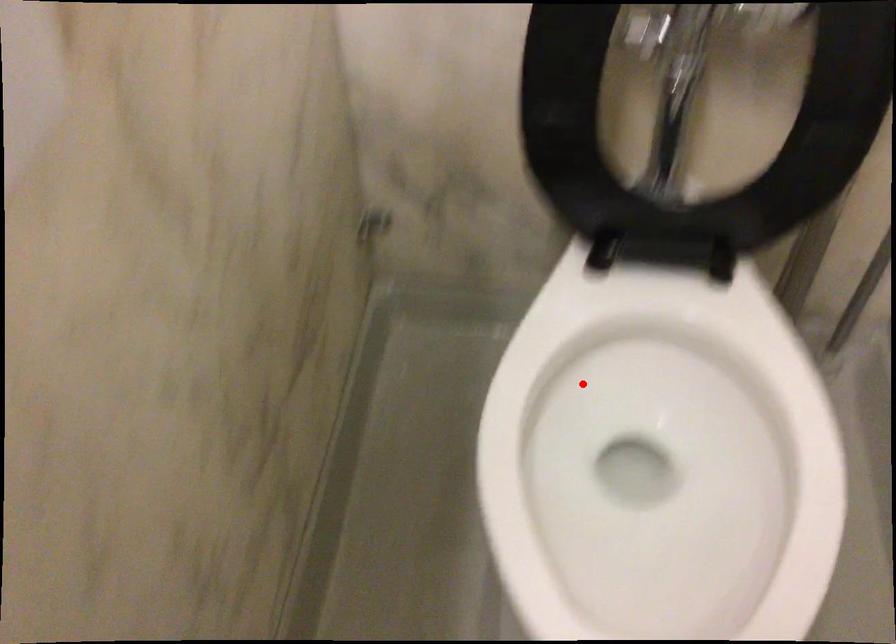
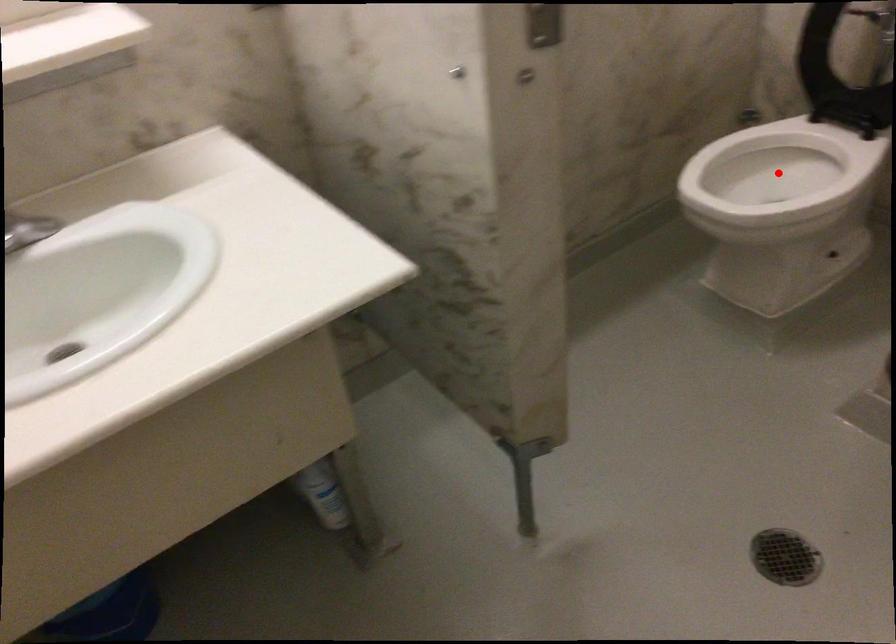
I am providing you with two images of the same scene from different viewpoints. A red point is marked on the first image and another point is marked on the second image. Does the point marked in image1 correspond to the same location as the one in image2?

Yes